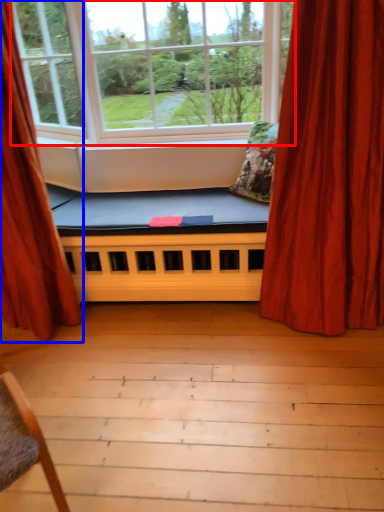
Question: Which point is further to the camera, window (highlighted by a red box) or curtain (highlighted by a blue box)?

Choices:
 (A) window
 (B) curtain

Answer: (A)